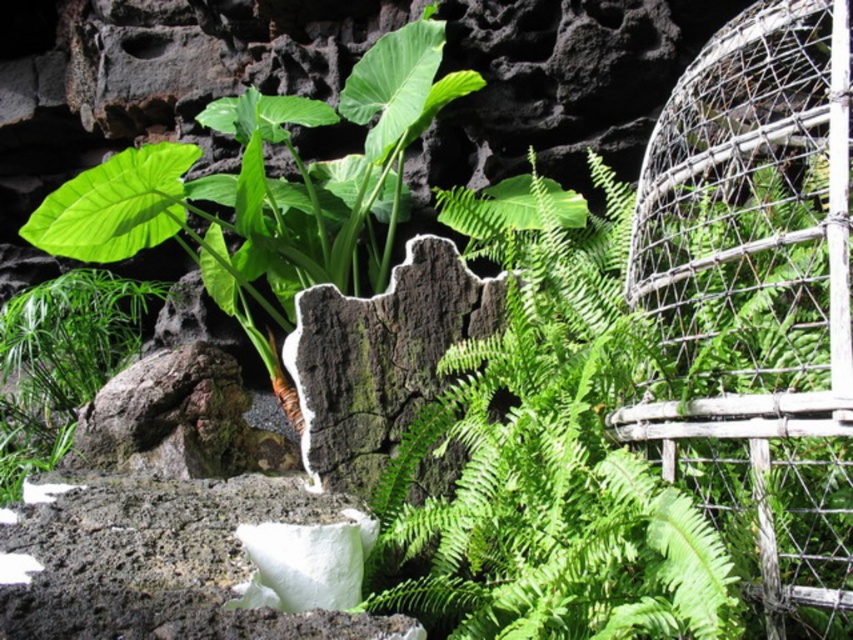
You are a gardener planning to place a new decorative item in the garden. You have a small statue that is 1 foot wide. You want to place it next to the green leafy plant at center and the dark brown rough stone at center. Based on their widths, which existing object should you place it next to to ensure it fits well?

The green leafy plant at center might be wider than the dark brown rough stone at center, so placing the 1 foot wide statue next to the dark brown rough stone at center would ensure it fits better.

You are a gardener planning to place a new plant in the garden. The garden has a rustic wire birdcage at right. Where should you place the new plant to ensure it is not directly under the birdcage?

The rustic wire birdcage at right is located at coordinates point (757, 304). To avoid placing the new plant directly under it, choose a spot that is not at those coordinates.